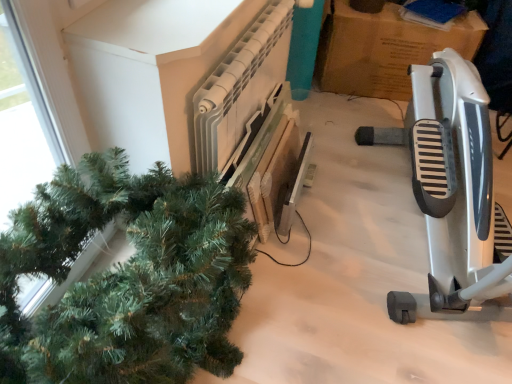
This screenshot has height=384, width=512. In order to click on green matte christmas tree at left in this screenshot , I will do [x=127, y=277].

Find the location of a particular element. The height and width of the screenshot is (384, 512). cardboard at upper right is located at coordinates (384, 49).

What are the coordinates of `silver metallic exercise bike at right` in the screenshot? It's located at (451, 191).

What is the approximate height of silver metallic exercise bike at right?

silver metallic exercise bike at right is 3.49 feet tall.

The width and height of the screenshot is (512, 384). What are the coordinates of `white plastic radiator at upper center` in the screenshot? It's located at (234, 81).

Based on the photo, considering the relative positions of white plastic radiator at upper center and green matte christmas tree at left in the image provided, is white plastic radiator at upper center to the right of green matte christmas tree at left from the viewer's perspective?

Indeed, white plastic radiator at upper center is positioned on the right side of green matte christmas tree at left.

From the picture: From the image's perspective, between white plastic radiator at upper center and green matte christmas tree at left, who is located below?

green matte christmas tree at left appears lower in the image.

From a real-world perspective, is white plastic radiator at upper center positioned above or below green matte christmas tree at left?

In terms of real-world spatial position, white plastic radiator at upper center is above green matte christmas tree at left.

Looking at this image, what's the angular difference between white plastic radiator at upper center and green matte christmas tree at left's facing directions?

The angle between the facing direction of white plastic radiator at upper center and the facing direction of green matte christmas tree at left is 1.88 degrees.

Locate an element on the screen. cardboard box that is on the right side of green matte christmas tree at left is located at coordinates (384, 49).

Is there a large distance between cardboard at upper right and green matte christmas tree at left?

Yes, cardboard at upper right and green matte christmas tree at left are located far from each other.

From the image's perspective, which one is positioned higher, green matte christmas tree at left or silver metallic exercise bike at right?

silver metallic exercise bike at right, from the image's perspective.

Is green matte christmas tree at left positioned with its back to silver metallic exercise bike at right?

No, green matte christmas tree at left's orientation is not away from silver metallic exercise bike at right.

The width and height of the screenshot is (512, 384). I want to click on houseplant on the left of silver metallic exercise bike at right, so click(127, 277).

Does green matte christmas tree at left have a smaller size compared to silver metallic exercise bike at right?

Indeed, green matte christmas tree at left has a smaller size compared to silver metallic exercise bike at right.

Find the location of a particular element. Image resolution: width=512 pixels, height=384 pixels. houseplant beneath the silver metallic exercise bike at right (from a real-world perspective) is located at coordinates (127, 277).

Is silver metallic exercise bike at right taller than green matte christmas tree at left?

Yes, silver metallic exercise bike at right is taller than green matte christmas tree at left.

Between silver metallic exercise bike at right and green matte christmas tree at left, which one has larger width?

Wider between the two is silver metallic exercise bike at right.

Which point is more forward, (409, 114) or (121, 309)?

The point (121, 309) is more forward.

In terms of size, does silver metallic exercise bike at right appear bigger or smaller than cardboard at upper right?

In the image, silver metallic exercise bike at right appears to be larger than cardboard at upper right.

Does silver metallic exercise bike at right have a lesser height compared to cardboard at upper right?

No, silver metallic exercise bike at right is not shorter than cardboard at upper right.

From a real-world perspective, does silver metallic exercise bike at right sit lower than cardboard at upper right?

No.

Is silver metallic exercise bike at right completely or partially outside of cardboard at upper right?

Indeed, silver metallic exercise bike at right is completely outside cardboard at upper right.

Locate an element on the screen. cardboard box above the white plastic radiator at upper center (from the image's perspective) is located at coordinates tap(384, 49).

Consider the image. Between cardboard at upper right and white plastic radiator at upper center, which one has larger size?

cardboard at upper right.

Which object is wider, cardboard at upper right or white plastic radiator at upper center?

With larger width is cardboard at upper right.

Which is more distant, (340, 14) or (250, 68)?

The point (340, 14) is farther from the camera.

From the image's perspective, is white plastic radiator at upper center positioned above or below cardboard at upper right?

white plastic radiator at upper center is below cardboard at upper right.

Is white plastic radiator at upper center oriented away from cardboard at upper right?

No.

Is white plastic radiator at upper center in contact with cardboard at upper right?

No, white plastic radiator at upper center is not touching cardboard at upper right.

The width and height of the screenshot is (512, 384). I want to click on radiator behind the green matte christmas tree at left, so [x=234, y=81].

This screenshot has height=384, width=512. In order to click on houseplant to the left of cardboard at upper right in this screenshot , I will do `click(127, 277)`.

When comparing their distances from green matte christmas tree at left, does silver metallic exercise bike at right or cardboard at upper right seem closer?

silver metallic exercise bike at right is closer to green matte christmas tree at left.

Looking at the image, which one is located closer to white plastic radiator at upper center, green matte christmas tree at left or silver metallic exercise bike at right?

Among the two, green matte christmas tree at left is located nearer to white plastic radiator at upper center.

Estimate the real-world distances between objects in this image. Which object is further from silver metallic exercise bike at right, green matte christmas tree at left or cardboard at upper right?

The object further to silver metallic exercise bike at right is green matte christmas tree at left.

Based on their spatial positions, is white plastic radiator at upper center or cardboard at upper right further from green matte christmas tree at left?

cardboard at upper right is further to green matte christmas tree at left.

Based on their spatial positions, is cardboard at upper right or white plastic radiator at upper center closer to silver metallic exercise bike at right?

Based on the image, white plastic radiator at upper center appears to be nearer to silver metallic exercise bike at right.

Based on their spatial positions, is cardboard at upper right or white plastic radiator at upper center closer to green matte christmas tree at left?

white plastic radiator at upper center is positioned closer to the anchor green matte christmas tree at left.

Looking at the image, which one is located closer to cardboard at upper right, silver metallic exercise bike at right or green matte christmas tree at left?

Among the two, silver metallic exercise bike at right is located nearer to cardboard at upper right.

Looking at the image, which one is located further to cardboard at upper right, green matte christmas tree at left or silver metallic exercise bike at right?

Among the two, green matte christmas tree at left is located further to cardboard at upper right.

Find the location of a particular element. The height and width of the screenshot is (384, 512). radiator between silver metallic exercise bike at right and cardboard at upper right from front to back is located at coordinates (234, 81).

Identify the location of houseplant between silver metallic exercise bike at right and cardboard at upper right in the front-back direction. This screenshot has height=384, width=512. point(127,277).

At what (x,y) coordinates should I click in order to perform the action: click on radiator positioned between green matte christmas tree at left and cardboard at upper right from near to far. Please return your answer as a coordinate pair (x, y). The image size is (512, 384). Looking at the image, I should click on point(234,81).

Locate an element on the screen. This screenshot has width=512, height=384. radiator situated between green matte christmas tree at left and silver metallic exercise bike at right from left to right is located at coordinates (234, 81).